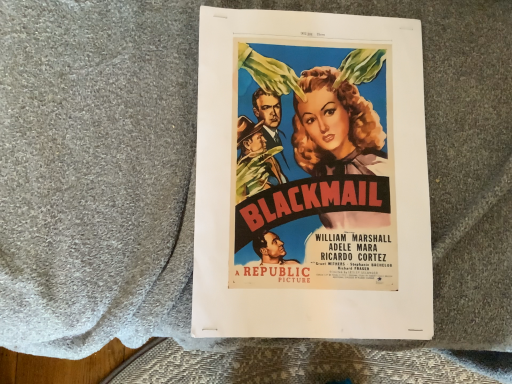
This screenshot has width=512, height=384. I want to click on empty space that is ontop of matte paper poster at center (from a real-world perspective), so click(x=317, y=168).